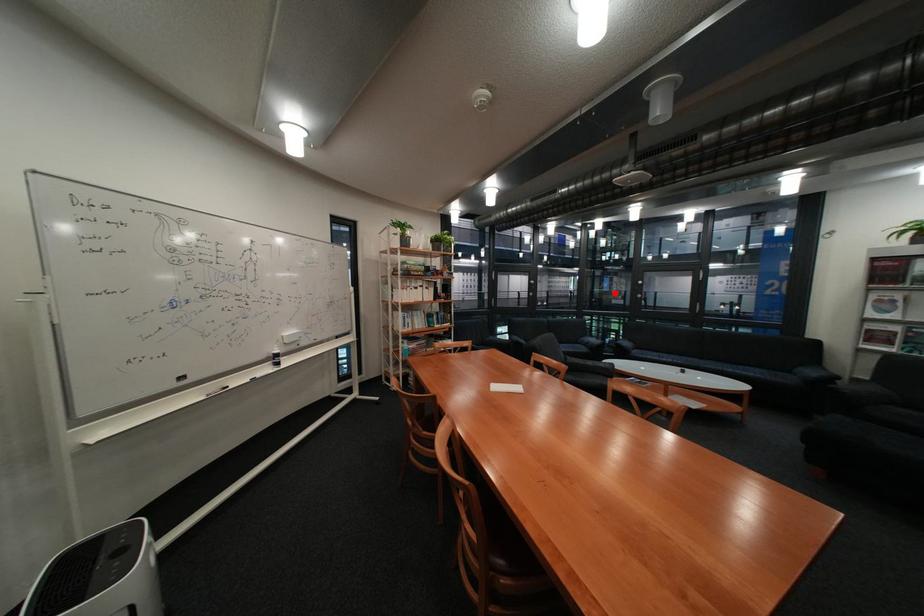
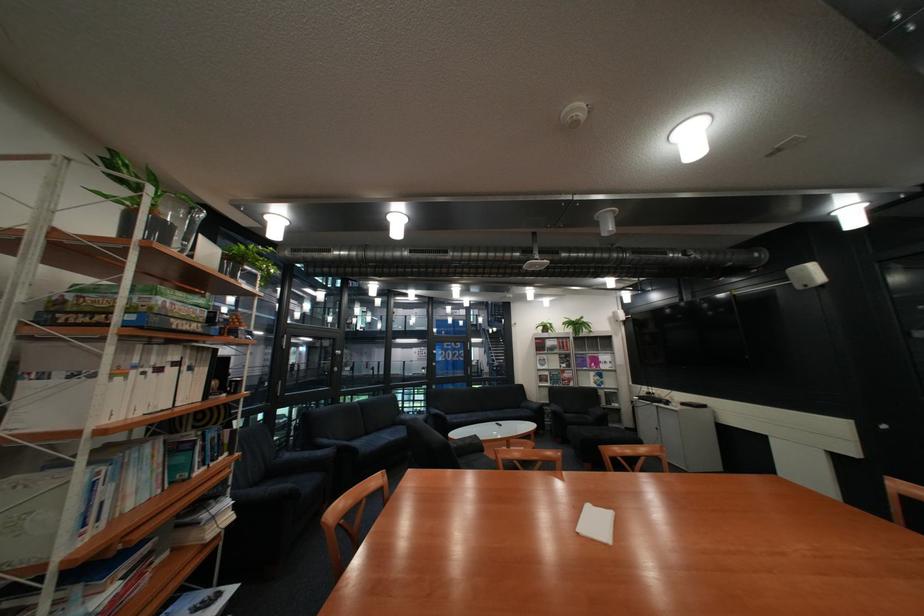
Where in the second image is the point corresponding to the highlighted location from the first image?

(344, 365)